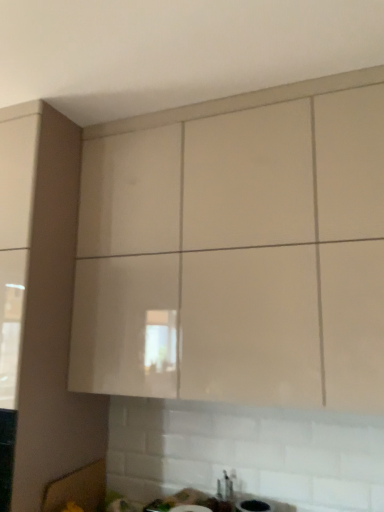
The width and height of the screenshot is (384, 512). What do you see at coordinates (237, 249) in the screenshot?
I see `matte beige cabinet at upper center` at bounding box center [237, 249].

Measure the distance between point (230, 206) and camera.

Point (230, 206) is 1.54 meters away from camera.

Where is `matte beige cabinet at upper center`? matte beige cabinet at upper center is located at coordinates (237, 249).

Image resolution: width=384 pixels, height=512 pixels. Describe the element at coordinates (223, 496) in the screenshot. I see `white glossy sink at lower center` at that location.

Identify the location of white glossy sink at lower center. This screenshot has height=512, width=384. (223, 496).

I want to click on matte beige cabinet at upper center, so click(x=237, y=249).

Is matte beige cabinet at upper center to the left of white glossy sink at lower center from the viewer's perspective?

Incorrect, matte beige cabinet at upper center is not on the left side of white glossy sink at lower center.

Which is behind, matte beige cabinet at upper center or white glossy sink at lower center?

white glossy sink at lower center is behind.

Is point (306, 158) in front of point (226, 487)?

Yes, it is.

From the image's perspective, is matte beige cabinet at upper center on top of white glossy sink at lower center?

Yes.

From a real-world perspective, is matte beige cabinet at upper center physically located above or below white glossy sink at lower center?

matte beige cabinet at upper center is above white glossy sink at lower center.

Is matte beige cabinet at upper center wider than white glossy sink at lower center?

Yes, matte beige cabinet at upper center is wider than white glossy sink at lower center.

Is matte beige cabinet at upper center taller than white glossy sink at lower center?

Yes.

Which of these two, matte beige cabinet at upper center or white glossy sink at lower center, is bigger?

matte beige cabinet at upper center.

Is white glossy sink at lower center completely or partially inside matte beige cabinet at upper center?

That's incorrect, white glossy sink at lower center is not inside matte beige cabinet at upper center.

Is matte beige cabinet at upper center next to white glossy sink at lower center?

There is a gap between matte beige cabinet at upper center and white glossy sink at lower center.

Is matte beige cabinet at upper center facing towards white glossy sink at lower center?

No, matte beige cabinet at upper center does not turn towards white glossy sink at lower center.

How different are the orientations of matte beige cabinet at upper center and white glossy sink at lower center in degrees?

The angle between the facing direction of matte beige cabinet at upper center and the facing direction of white glossy sink at lower center is 0.69 degrees.

Where is `sink below the matte beige cabinet at upper center (from a real-world perspective)`? Image resolution: width=384 pixels, height=512 pixels. sink below the matte beige cabinet at upper center (from a real-world perspective) is located at coordinates (223, 496).

Which is more to the right, white glossy sink at lower center or matte beige cabinet at upper center?

matte beige cabinet at upper center.

Based on the photo, which object is further away from the camera taking this photo, white glossy sink at lower center or matte beige cabinet at upper center?

white glossy sink at lower center is more distant.

Does point (211, 508) appear closer or farther from the camera than point (270, 141)?

Point (211, 508) is positioned farther from the camera compared to point (270, 141).

From the image's perspective, relative to matte beige cabinet at upper center, is white glossy sink at lower center above or below?

white glossy sink at lower center is below matte beige cabinet at upper center.

From a real-world perspective, between white glossy sink at lower center and matte beige cabinet at upper center, who is vertically lower?

From a 3D spatial view, white glossy sink at lower center is below.

Does white glossy sink at lower center have a lesser width compared to matte beige cabinet at upper center?

Yes, white glossy sink at lower center is thinner than matte beige cabinet at upper center.

Which of these two, white glossy sink at lower center or matte beige cabinet at upper center, stands shorter?

white glossy sink at lower center is shorter.

Looking at the image, does white glossy sink at lower center seem bigger or smaller compared to matte beige cabinet at upper center?

In the image, white glossy sink at lower center appears to be smaller than matte beige cabinet at upper center.

Looking at this image, is white glossy sink at lower center situated inside matte beige cabinet at upper center or outside?

white glossy sink at lower center is not inside matte beige cabinet at upper center, it's outside.

Are white glossy sink at lower center and matte beige cabinet at upper center far apart?

They are positioned close to each other.

Does white glossy sink at lower center turn towards matte beige cabinet at upper center?

No, white glossy sink at lower center is not turned towards matte beige cabinet at upper center.

Can you tell me how much white glossy sink at lower center and matte beige cabinet at upper center differ in facing direction?

0.69 degrees separate the facing orientations of white glossy sink at lower center and matte beige cabinet at upper center.

Identify the location of cabinetry in front of the white glossy sink at lower center. (237, 249).

Identify the location of cabinetry above the white glossy sink at lower center (from the image's perspective). (237, 249).

Where is `cabinetry that appears in front of the white glossy sink at lower center`? The height and width of the screenshot is (512, 384). cabinetry that appears in front of the white glossy sink at lower center is located at coordinates (237, 249).